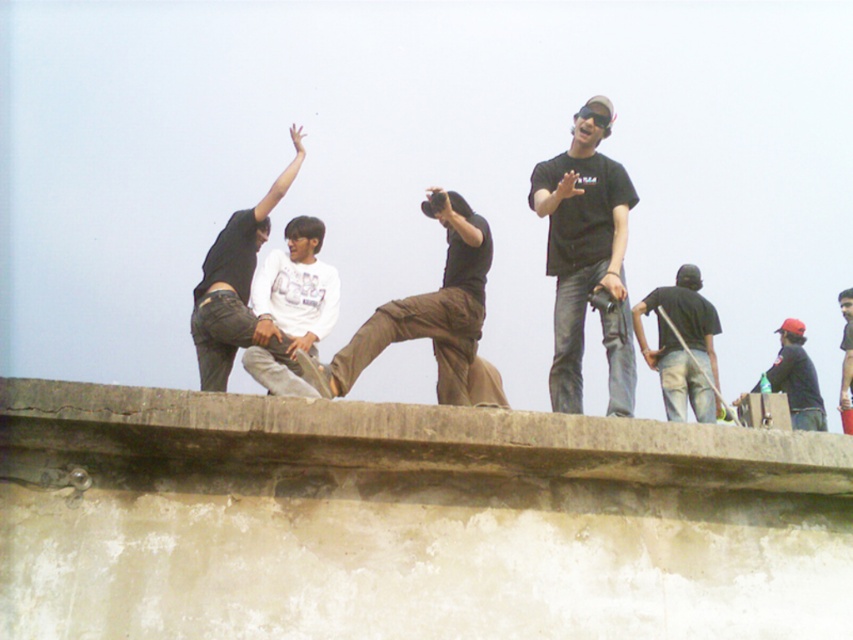
You are a photographer trying to capture a group shot of the people on the ledge. You notice the white matte shirt at center and the smooth black shirt at upper center. Which person should you focus on first if you want to ensure both shirts are in the frame, considering their sizes?

The white matte shirt at center has a lesser width compared to the smooth black shirt at upper center, so you should focus on the white matte shirt at center first to ensure both are in the frame.

You are a photographer trying to capture a shot of the black matte shirt at upper center. The camera you are using has a focal length of 50mm. If the shirt is located at coordinates 0.402 on the x and 0.688 on the y axis, can you estimate whether it will be within the frame of the camera?

The black matte shirt at upper center is located at coordinates 0.402 on the x and 0.688 on the y axis, so it will be within the frame of the camera with a 50mm focal length.

In the scene shown: You are a photographer trying to capture a candid shot of the white matte shirt at center and the smooth black shirt at upper center. Since you want both subjects to be in focus, you need to know which one is closer to you. Based on the scene, which shirt is closer?

The white matte shirt at center is closer to you because it is shorter than the smooth black shirt at upper center, meaning it appears lower in the frame and thus nearer.